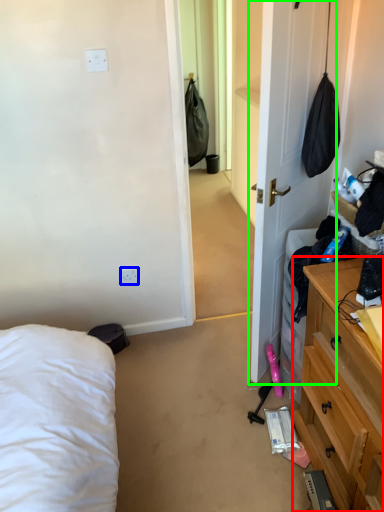
Question: Which is farther away from cabinetry (highlighted by a red box)? electric outlet (highlighted by a blue box) or door (highlighted by a green box)?

Choices:
 (A) electric outlet
 (B) door

Answer: (A)